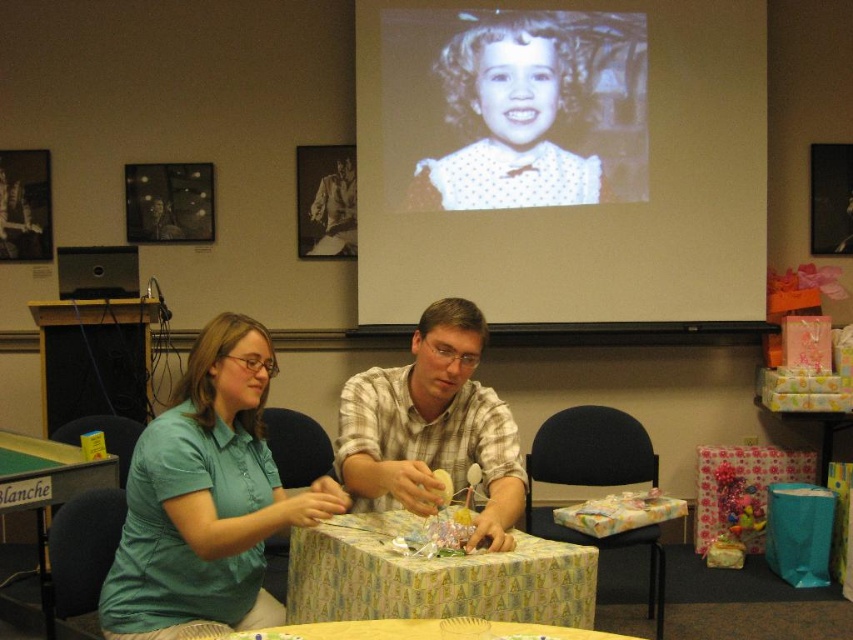
Which is in front, point (456, 179) or point (62, 472)?

Point (62, 472) is in front.

Can you confirm if white dotted dress at upper center is smaller than green fabric table at lower left?

Yes, white dotted dress at upper center is smaller than green fabric table at lower left.

Is point (471, 74) farther from viewer compared to point (51, 488)?

Yes, it is.

Locate an element on the screen. white dotted dress at upper center is located at coordinates click(509, 118).

Is teal shirt at center above plaid shirt at center?

Incorrect, teal shirt at center is not positioned above plaid shirt at center.

I want to click on teal shirt at center, so click(x=206, y=497).

Does teal shirt at center appear over green fabric table at lower left?

Correct, teal shirt at center is located above green fabric table at lower left.

In the scene shown: Can you confirm if teal shirt at center is smaller than green fabric table at lower left?

Actually, teal shirt at center might be larger than green fabric table at lower left.

The height and width of the screenshot is (640, 853). What do you see at coordinates (206, 497) in the screenshot?
I see `teal shirt at center` at bounding box center [206, 497].

You are a GUI agent. You are given a task and a screenshot of the screen. Output one action in this format:
    pyautogui.click(x=<x>, y=<y>)
    Task: Click on the teal shirt at center
    The image size is (853, 640).
    Given the screenshot: What is the action you would take?
    pyautogui.click(x=206, y=497)